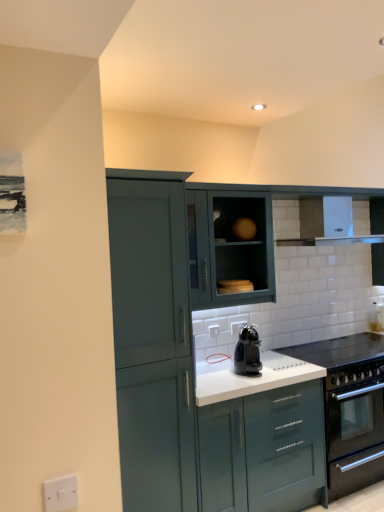
Question: Which direction should I rotate to look at matte green cabinet at upper center, marked as the fourth cabinetry in a front-to-back arrangement, — up or down?

Choices:
 (A) up
 (B) down

Answer: (B)

Question: Is matte dark green cabinet at upper center, the 2th cabinetry from the back, thinner than matte teal cabinet at center, which is the 3th cabinetry in back-to-front order?

Choices:
 (A) no
 (B) yes

Answer: (B)

Question: From the image's perspective, is matte dark green cabinet at upper center, the 3th cabinetry positioned from the front, on top of matte teal cabinet at center, arranged as the 2th cabinetry when viewed from the front?

Choices:
 (A) yes
 (B) no

Answer: (A)

Question: Is matte dark green cabinet at upper center, the 2th cabinetry from the back, placed right next to matte teal cabinet at center, which is the 3th cabinetry in back-to-front order?

Choices:
 (A) yes
 (B) no

Answer: (B)

Question: Is matte dark green cabinet at upper center, the 2th cabinetry from the back, further to the viewer compared to matte teal cabinet at center, which is the 3th cabinetry in back-to-front order?

Choices:
 (A) no
 (B) yes

Answer: (B)

Question: Is matte dark green cabinet at upper center, the 3th cabinetry positioned from the front, outside matte teal cabinet at center, which is the 3th cabinetry in back-to-front order?

Choices:
 (A) yes
 (B) no

Answer: (A)

Question: Is matte dark green cabinet at upper center, the 2th cabinetry from the back, positioned far away from matte teal cabinet at center, which is the 3th cabinetry in back-to-front order?

Choices:
 (A) no
 (B) yes

Answer: (A)

Question: Are matte teal cabinet at center, arranged as the 2th cabinetry when viewed from the front, and white glossy countertop at center located far from each other?

Choices:
 (A) no
 (B) yes

Answer: (A)

Question: Can you confirm if matte teal cabinet at center, which is the 3th cabinetry in back-to-front order, is shorter than white glossy countertop at center?

Choices:
 (A) no
 (B) yes

Answer: (A)

Question: Would you say white glossy countertop at center is part of matte teal cabinet at center, arranged as the 2th cabinetry when viewed from the front,'s contents?

Choices:
 (A) no
 (B) yes

Answer: (A)

Question: From the image's perspective, is matte teal cabinet at center, which is the 3th cabinetry in back-to-front order, located beneath white glossy countertop at center?

Choices:
 (A) no
 (B) yes

Answer: (B)

Question: Considering the relative sizes of matte teal cabinet at center, arranged as the 2th cabinetry when viewed from the front, and white glossy countertop at center in the image provided, is matte teal cabinet at center, arranged as the 2th cabinetry when viewed from the front, wider than white glossy countertop at center?

Choices:
 (A) yes
 (B) no

Answer: (A)

Question: From a real-world perspective, is matte teal cabinet at center, arranged as the 2th cabinetry when viewed from the front, physically above white glossy countertop at center?

Choices:
 (A) no
 (B) yes

Answer: (A)

Question: From a real-world perspective, is white plastic electric outlet at lower left located beneath white glossy countertop at center?

Choices:
 (A) yes
 (B) no

Answer: (B)